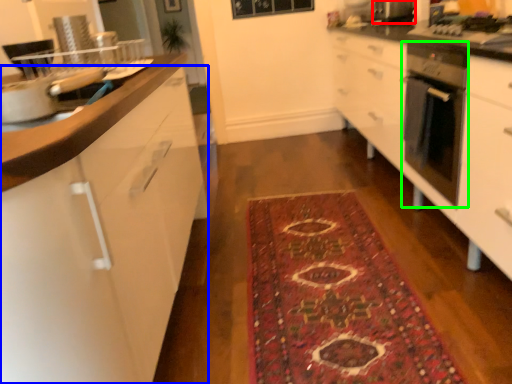
Question: Which object is positioned closest to appliance (highlighted by a red box)? Select from cabinetry (highlighted by a blue box) and home appliance (highlighted by a green box).

Choices:
 (A) cabinetry
 (B) home appliance

Answer: (B)